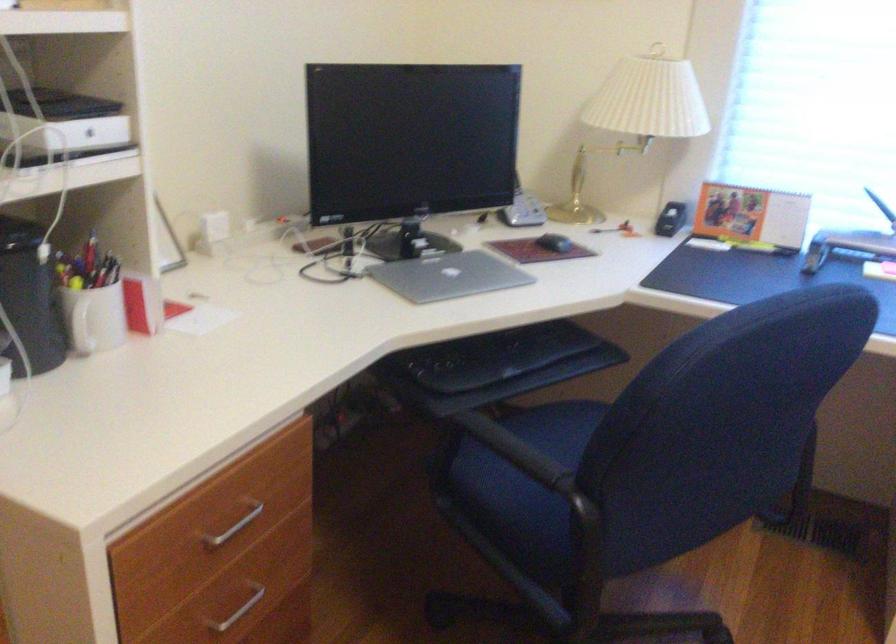
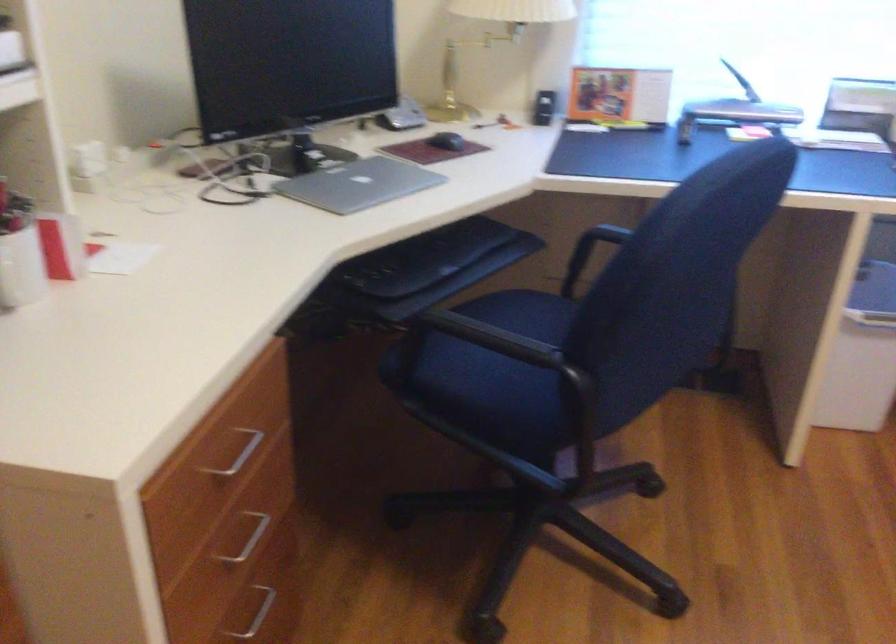
In the second image, find the point that corresponds to point (443, 276) in the first image.

(358, 184)